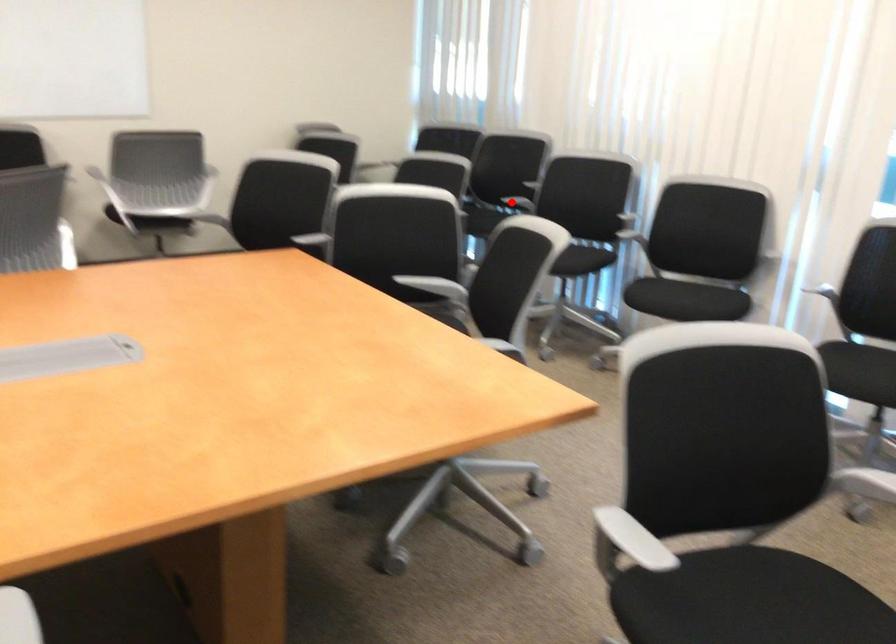
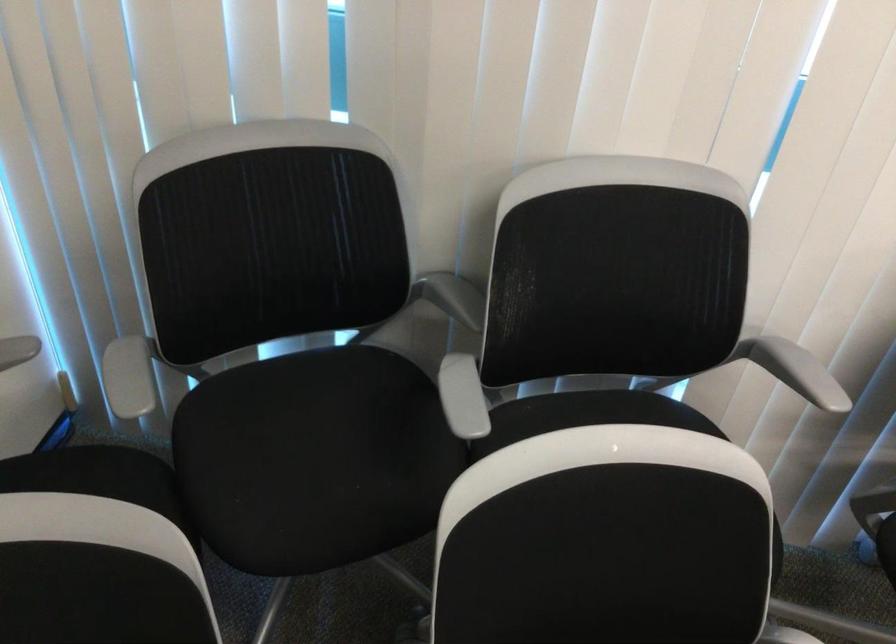
Locate, in the second image, the point that corresponds to the highlighted location in the first image.

(605, 412)